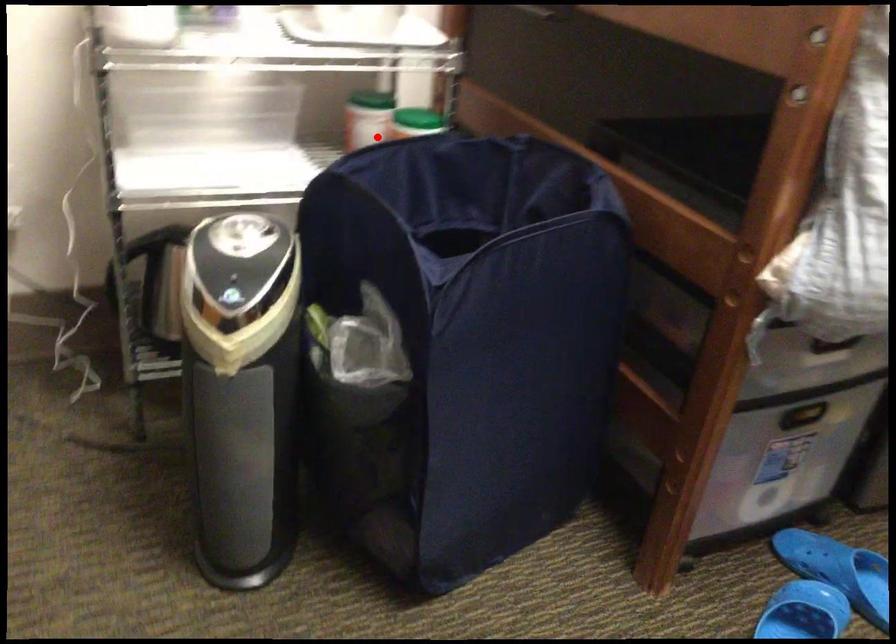
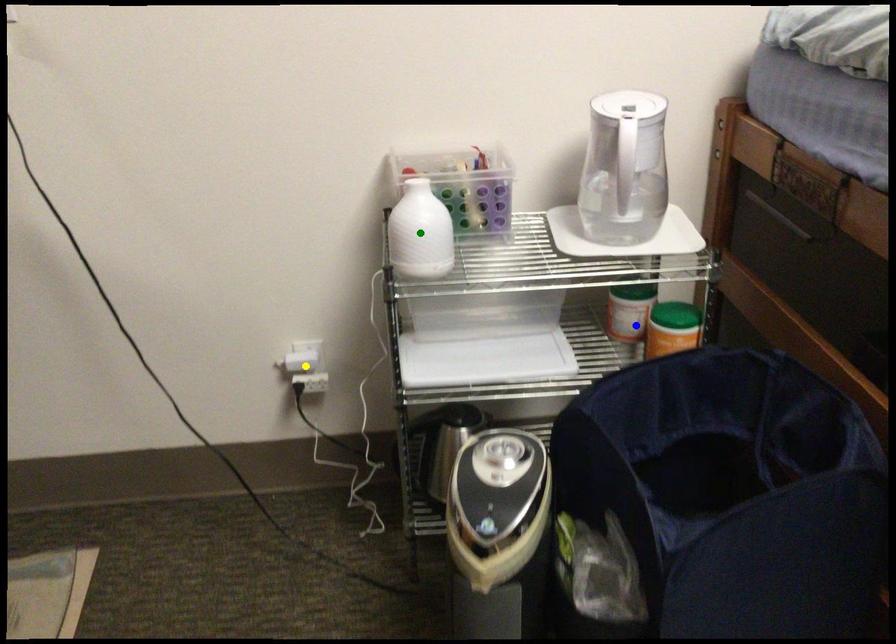
Question: I am providing you with two images of the same scene from different viewpoints. A red point is marked on the first image. You are given multiple points on the second image. Which mark in image 2 goes with the point in image 1?

Choices:
 (A) green point
 (B) yellow point
 (C) blue point

Answer: (C)